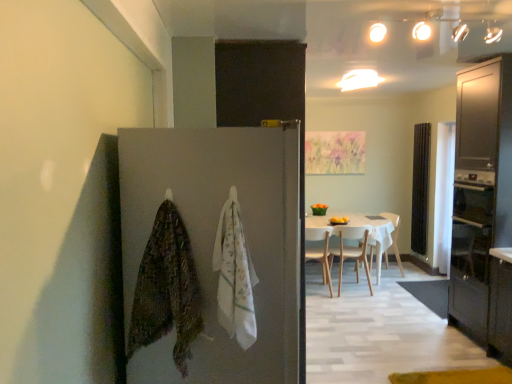
Question: Considering the relative positions of matte gray door at center and matte dark wood cabinet at right in the image provided, is matte gray door at center to the left or to the right of matte dark wood cabinet at right?

Choices:
 (A) right
 (B) left

Answer: (B)

Question: Is matte gray door at center spatially inside matte dark wood cabinet at right, or outside of it?

Choices:
 (A) outside
 (B) inside

Answer: (A)

Question: Considering the real-world distances, which object is closest to the textured multicolored blanket at left, marked as the 2th blanket in a right-to-left arrangement?

Choices:
 (A) white wood chair at center, the third chair when ordered from left to right
 (B) white glossy table at center
 (C) black wood screen door at right
 (D) wooden chair at center, which appears as the third chair when viewed from the right
 (E) white glossy light fixture at upper center

Answer: (E)

Question: Estimate the real-world distances between objects in this image. Which object is farther from the matte dark wood cabinet at right?

Choices:
 (A) black glass oven at right
 (B) white wood chair at center, placed as the second chair when sorted from right to left
 (C) white glossy light fixture at upper center
 (D) textured multicolored blanket at left, placed as the first blanket when sorted from left to right
 (E) matte gray door at center

Answer: (D)